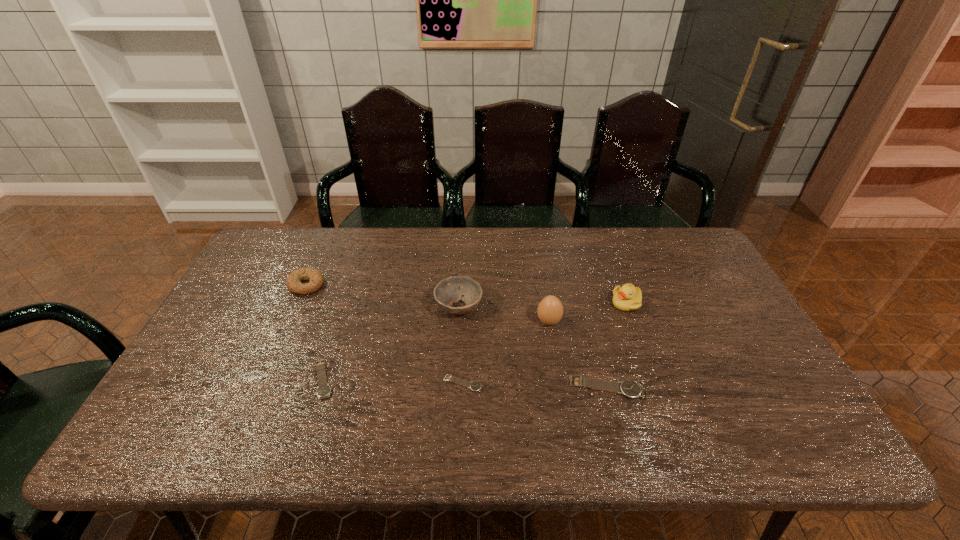
Where is `the tallest object`? The height and width of the screenshot is (540, 960). the tallest object is located at coordinates (550, 310).

Image resolution: width=960 pixels, height=540 pixels. I want to click on vacant space situated on the right of the second shortest object, so click(x=404, y=380).

Identify the location of vacant space positioned on the left of the second watch from left to right. (286, 383).

Image resolution: width=960 pixels, height=540 pixels. Find the location of `vacant space located on the back of the rightmost watch`. vacant space located on the back of the rightmost watch is located at coordinates (583, 296).

I want to click on free space located 0.150m on the front of the leftmost object, so click(284, 334).

Where is `vacant space located on the beak of the duckling`? The width and height of the screenshot is (960, 540). vacant space located on the beak of the duckling is located at coordinates (544, 303).

Identify the location of blank space located 0.250m on the beak of the duckling. The width and height of the screenshot is (960, 540). (527, 303).

You are a GUI agent. You are given a task and a screenshot of the screen. Output one action in this format:
    pyautogui.click(x=<x>, y=<y>)
    Task: Click on the vacant space positioned 0.320m on the beak of the duckling
    The height and width of the screenshot is (540, 960).
    Given the screenshot: What is the action you would take?
    [x=504, y=303]

Find the location of `vacant area situated 0.210m on the front of the bowl`. vacant area situated 0.210m on the front of the bowl is located at coordinates (454, 389).

Where is `free space located 0.180m on the left of the tallest object`? free space located 0.180m on the left of the tallest object is located at coordinates (472, 321).